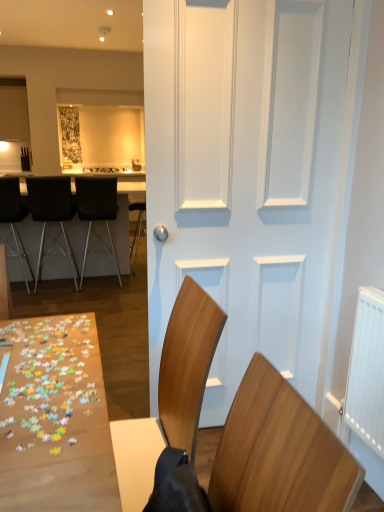
Describe the element at coordinates (367, 371) in the screenshot. I see `white plastic radiator at right` at that location.

The image size is (384, 512). What do you see at coordinates (250, 177) in the screenshot?
I see `white matte door at center` at bounding box center [250, 177].

What is the approximate height of black leather chair at left, which is the 2th chair from left to right?

black leather chair at left, which is the 2th chair from left to right, is 3.62 feet in height.

This screenshot has height=512, width=384. In order to click on white plastic radiator at right in this screenshot , I will do `click(367, 371)`.

Considering the points (81, 203) and (180, 487), which point is in front, point (81, 203) or point (180, 487)?

The point (180, 487) is closer to the camera.

Is black leather chair at center, which is counted as the 4th chair, starting from the front, aimed at wooden chair at lower right, the first chair from the front?

No, black leather chair at center, which is counted as the 4th chair, starting from the front, is not turned towards wooden chair at lower right, the first chair from the front.

Where is `the 3rd chair below the black leather chair at center, which is counted as the third chair, starting from the left (from the image's perspective)`? The height and width of the screenshot is (512, 384). the 3rd chair below the black leather chair at center, which is counted as the third chair, starting from the left (from the image's perspective) is located at coordinates (268, 457).

From the image's perspective, is black leather chair at center, which is the first chair from back to front, located beneath wooden chair at lower right, the fourth chair viewed from the back?

Actually, black leather chair at center, which is the first chair from back to front, appears above wooden chair at lower right, the fourth chair viewed from the back, in the image.

Is wooden chair at lower right, the fourth chair viewed from the back, directly adjacent to black leather chair at center, acting as the second chair starting from the right?

No, wooden chair at lower right, the fourth chair viewed from the back, is not with black leather chair at center, acting as the second chair starting from the right.

Between wooden chair at lower right, the fourth chair viewed from the back, and black leather chair at center, which is counted as the 4th chair, starting from the front, which one has more height?

With more height is black leather chair at center, which is counted as the 4th chair, starting from the front.

At what (x,y) coordinates should I click in order to perform the action: click on chair positioned vertically above the black leather chair at center, which is counted as the third chair, starting from the left (from a real-world perspective). Please return your answer as a coordinate pair (x, y). The image size is (384, 512). Looking at the image, I should click on (268, 457).

Which is more to the left, wooden chair at lower right, the fourth chair viewed from the back, or black leather chair at left, the third chair viewed from the front?

black leather chair at left, the third chair viewed from the front.

From a real-world perspective, who is located lower, wooden chair at lower right, the first chair from the front, or black leather chair at left, which is the third chair in right-to-left order?

From a 3D spatial view, black leather chair at left, which is the third chair in right-to-left order, is below.

Which object is more forward, wooden chair at lower right, the fourth chair viewed from the back, or black leather chair at left, the third chair viewed from the front?

wooden chair at lower right, the fourth chair viewed from the back, is closer to the camera.

Between wooden chair at lower right, the fourth chair viewed from the back, and black leather chair at left, which is the third chair in right-to-left order, which one has larger size?

With larger size is black leather chair at left, which is the third chair in right-to-left order.

Is point (153, 509) closer or farther from the camera than point (6, 215)?

Clearly, point (153, 509) is closer to the camera than point (6, 215).

In terms of height, does wooden chair at lower right, the fourth chair viewed from the back, look taller or shorter compared to black metal bar stool at left, which is counted as the 1th chair, starting from the left?

Considering their sizes, wooden chair at lower right, the fourth chair viewed from the back, has less height than black metal bar stool at left, which is counted as the 1th chair, starting from the left.

From the image's perspective, which chair is the 1st one above the wooden chair at lower right, the first chair in the right-to-left sequence? Please provide its 2D coordinates.

[(14, 217)]

Considering the positions of objects wooden chair at lower right, the first chair in the right-to-left sequence, and black metal bar stool at left, the 2th chair when ordered from front to back, in the image provided, who is more to the right, wooden chair at lower right, the first chair in the right-to-left sequence, or black metal bar stool at left, the 2th chair when ordered from front to back,?

Positioned to the right is wooden chair at lower right, the first chair in the right-to-left sequence.

Which object is further away from the camera taking this photo, black leather chair at center, acting as the second chair starting from the right, or black metal bar stool at left, which is counted as the 1th chair, starting from the left?

Positioned behind is black leather chair at center, acting as the second chair starting from the right.

Considering the positions of point (84, 258) and point (19, 195), is point (84, 258) closer or farther from the camera than point (19, 195)?

Point (84, 258).

Can black metal bar stool at left, which is counted as the 1th chair, starting from the left, be found inside black leather chair at center, acting as the second chair starting from the right?

That's incorrect, black metal bar stool at left, which is counted as the 1th chair, starting from the left, is not inside black leather chair at center, acting as the second chair starting from the right.

I want to click on the 4th chair counting from the left side of the white matte door at center, so click(14, 217).

In the scene shown: From the image's perspective, which one is positioned higher, black metal bar stool at left, the 2th chair when ordered from front to back, or white matte door at center?

black metal bar stool at left, the 2th chair when ordered from front to back, appears higher in the image.

Does black metal bar stool at left, the 2th chair when ordered from front to back, appear on the right side of white matte door at center?

No.

From a real-world perspective, is white matte door at center positioned under black leather chair at left, the third chair viewed from the front, based on gravity?

No.

Can you confirm if white matte door at center is bigger than black leather chair at left, which is counted as the second chair, starting from the back?

Correct, white matte door at center is larger in size than black leather chair at left, which is counted as the second chair, starting from the back.

Which object is closer to the camera taking this photo, white matte door at center or black leather chair at left, the third chair viewed from the front?

white matte door at center is in front.

Would you consider white matte door at center to be distant from black leather chair at left, which is the 2th chair from left to right?

Yes, white matte door at center and black leather chair at left, which is the 2th chair from left to right, are quite far apart.

Find the location of a particular element. chair on the right of black leather chair at center, which is counted as the third chair, starting from the left is located at coordinates (268, 457).

You are a GUI agent. You are given a task and a screenshot of the screen. Output one action in this format:
    pyautogui.click(x=<x>, y=<y>)
    Task: Click on the chair that is the 3rd object located below the black leather chair at center, which is counted as the third chair, starting from the left (from the image's perspective)
    
    Given the screenshot: What is the action you would take?
    pyautogui.click(x=268, y=457)

Looking at this image, which object lies nearer to the anchor point wooden chair at lower right, the first chair from the front, black leather chair at left, the third chair viewed from the front, or white matte door at center?

white matte door at center lies closer to wooden chair at lower right, the first chair from the front, than the other object.

Estimate the real-world distances between objects in this image. Which object is further from black leather chair at center, which is counted as the 4th chair, starting from the front, black leather table at left or white matte door at center?

white matte door at center is positioned further to the anchor black leather chair at center, which is counted as the 4th chair, starting from the front.

In the scene shown: Looking at the image, which one is located closer to wooden chair at lower right, the first chair from the front, black metal bar stool at left, which is the 3th chair in back-to-front order, or white plastic radiator at right?

white plastic radiator at right is closer to wooden chair at lower right, the first chair from the front.

Considering their positions, is white matte door at center positioned closer to black metal bar stool at left, the 2th chair when ordered from front to back, than black leather table at left?

The object closer to black metal bar stool at left, the 2th chair when ordered from front to back, is black leather table at left.

Estimate the real-world distances between objects in this image. Which object is closer to black metal bar stool at left, which is the 3th chair in back-to-front order, black leather table at left or black leather chair at left, the third chair viewed from the front?

Based on the image, black leather chair at left, the third chair viewed from the front, appears to be nearer to black metal bar stool at left, which is the 3th chair in back-to-front order.

When comparing their distances from white matte door at center, does wooden chair at lower right, the fourth chair viewed from the back, or black leather table at left seem further?

The object further to white matte door at center is black leather table at left.

From the image, which object appears to be nearer to black leather chair at center, which is counted as the 4th chair, starting from the front, black leather chair at left, which is the third chair in right-to-left order, or black metal bar stool at left, which is the 3th chair in back-to-front order?

The object closer to black leather chair at center, which is counted as the 4th chair, starting from the front, is black leather chair at left, which is the third chair in right-to-left order.

When comparing their distances from black leather table at left, does black leather chair at left, which is the third chair in right-to-left order, or wooden chair at lower right, placed as the fourth chair when sorted from left to right, seem further?

wooden chair at lower right, placed as the fourth chair when sorted from left to right.

Identify the location of door located between white plastic radiator at right and black leather chair at center, which is counted as the 4th chair, starting from the front, in the depth direction. The height and width of the screenshot is (512, 384). (250, 177).

In order to click on table between wooden chair at lower right, the fourth chair viewed from the back, and black leather chair at center, which is counted as the 4th chair, starting from the front, in the front-back direction in this screenshot , I will do [x=123, y=224].

The height and width of the screenshot is (512, 384). Find the location of `chair between black metal bar stool at left, which is the 3th chair in back-to-front order, and black leather chair at center, acting as the second chair starting from the right, in the horizontal direction`. chair between black metal bar stool at left, which is the 3th chair in back-to-front order, and black leather chair at center, acting as the second chair starting from the right, in the horizontal direction is located at coordinates (52, 215).

I want to click on door situated between black metal bar stool at left, which is counted as the 1th chair, starting from the left, and white plastic radiator at right from left to right, so click(250, 177).